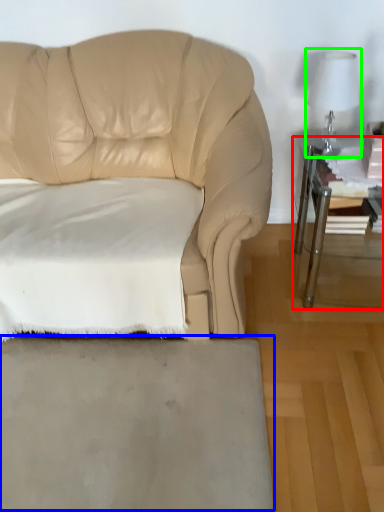
Question: Which object is positioned farthest from table (highlighted by a red box)? Select from concrete (highlighted by a blue box) and table lamp (highlighted by a green box).

Choices:
 (A) concrete
 (B) table lamp

Answer: (A)